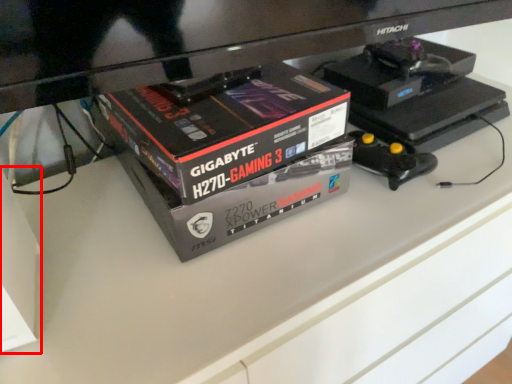
Question: From the image's perspective, what is the correct spatial positioning of box (annotated by the red box) in reference to box?

Choices:
 (A) below
 (B) above

Answer: (A)